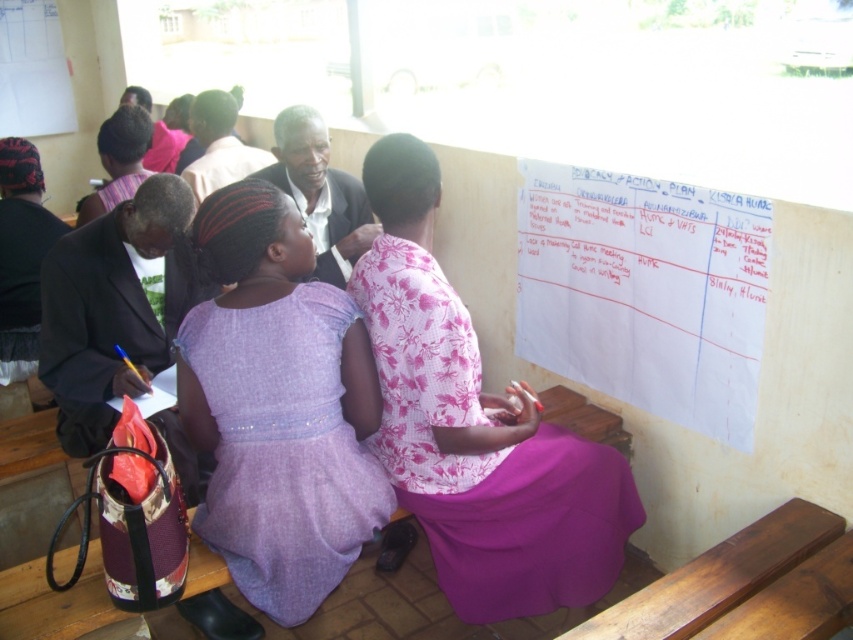
Question: Can you confirm if pink floral fabric dress at center is wider than purple satin dress at center?

Choices:
 (A) yes
 (B) no

Answer: (A)

Question: Which object is farther from the camera taking this photo?

Choices:
 (A) pink floral fabric dress at center
 (B) white paperboard at upper center
 (C) purple satin dress at center

Answer: (B)

Question: Which object appears farthest from the camera in this image?

Choices:
 (A) purple satin dress at center
 (B) white paperboard at upper center

Answer: (B)

Question: Can you confirm if pink floral fabric dress at center is positioned below white paperboard at upper center?

Choices:
 (A) yes
 (B) no

Answer: (A)

Question: Is pink floral fabric dress at center to the left of purple satin dress at center from the viewer's perspective?

Choices:
 (A) yes
 (B) no

Answer: (B)

Question: Which point is farther from the camera taking this photo?

Choices:
 (A) (299, 429)
 (B) (575, 604)
 (C) (659, 413)

Answer: (C)